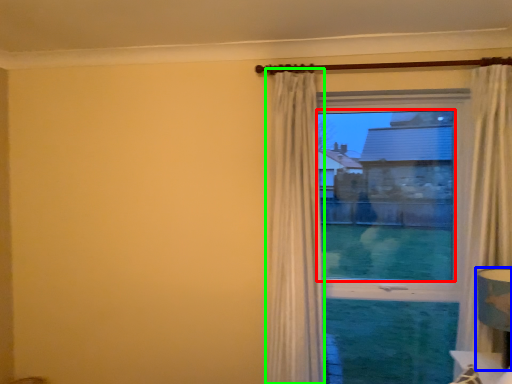
Question: Based on their relative distances, which object is nearer to window screen (highlighted by a red box)? Choose from table lamp (highlighted by a blue box) and curtain (highlighted by a green box).

Choices:
 (A) table lamp
 (B) curtain

Answer: (B)